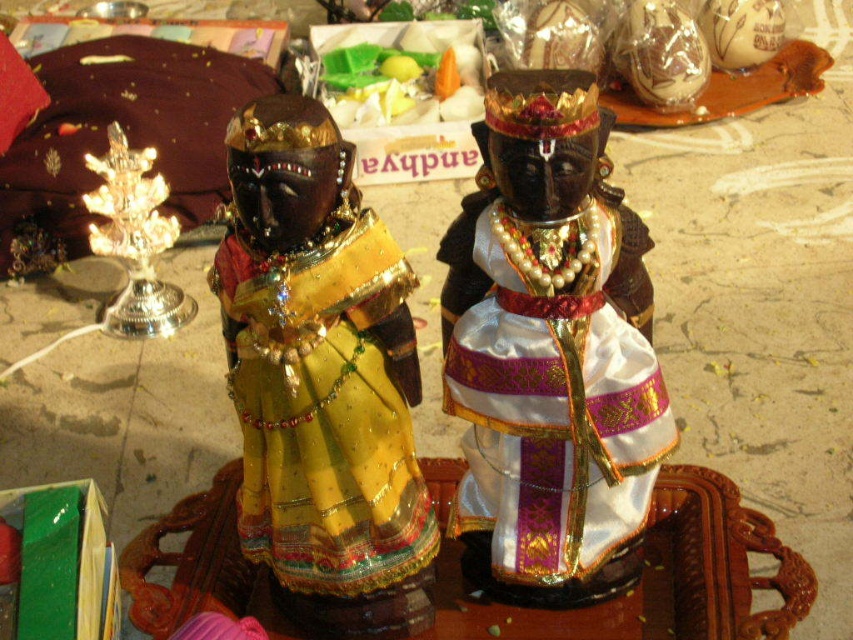
Is metallic gold figurine at center positioned behind white satin dress at center?

No, it is not.

Is point (413, 550) more distant than point (469, 499)?

That is False.

Between point (289, 371) and point (483, 403), which one is positioned in front?

Point (289, 371)

In order to click on metallic gold figurine at center in this screenshot , I will do `click(321, 380)`.

Which of these two, white satin dress at center or shiny silver candlestick at left, stands taller?

white satin dress at center

Does white satin dress at center appear on the right side of shiny silver candlestick at left?

Indeed, white satin dress at center is positioned on the right side of shiny silver candlestick at left.

Between point (491, 397) and point (138, 205), which one is positioned in front?

Point (491, 397)

This screenshot has width=853, height=640. In order to click on white satin dress at center in this screenshot , I will do `click(553, 400)`.

Between metallic gold figurine at center and shiny silver candlestick at left, which one is positioned lower?

metallic gold figurine at center is lower down.

The height and width of the screenshot is (640, 853). What do you see at coordinates (321, 380) in the screenshot? I see `metallic gold figurine at center` at bounding box center [321, 380].

Who is more distant from viewer, (318, 148) or (128, 218)?

The point (128, 218) is more distant.

Locate an element on the screen. Image resolution: width=853 pixels, height=640 pixels. metallic gold figurine at center is located at coordinates coord(321,380).